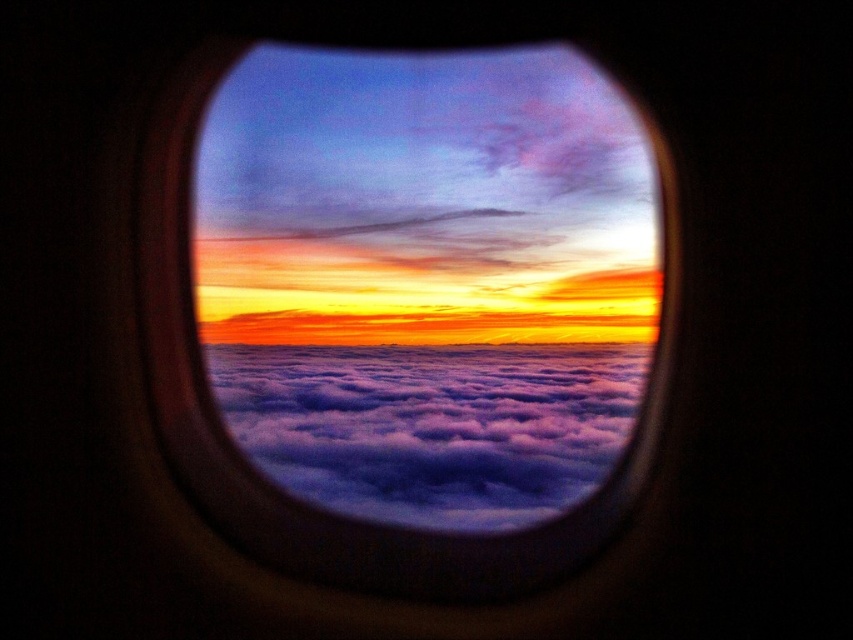
You are a passenger sitting by the window in an airplane. You notice the transparent glass airplane window at center and the cloudy at center outside. Which object is closer to the ceiling of the airplane?

The transparent glass airplane window at center is closer to the ceiling of the airplane because it is positioned above the cloudy at center.

Looking at this image, you are sitting in an airplane seat and looking out the window. You notice the transparent glass airplane window at center and the cloudy at center. Which object is positioned to the right side?

The transparent glass airplane window at center is to the right of cloudy at center.